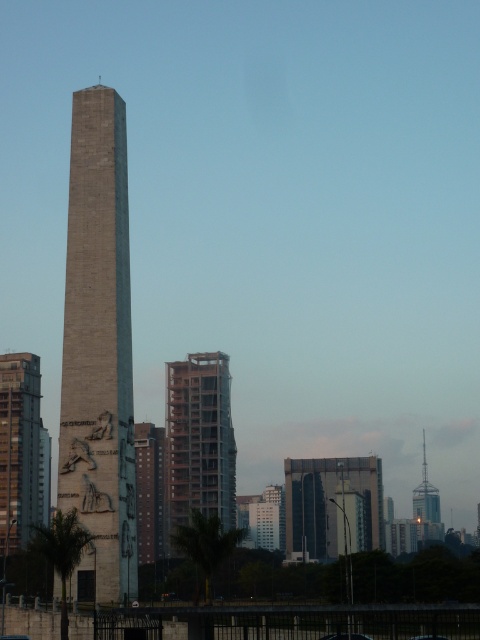
Question: From the image, what is the correct spatial relationship of gray stone obelisk at center in relation to dark glass building at center?

Choices:
 (A) above
 (B) below

Answer: (A)

Question: Which point appears farthest from the camera in this image?

Choices:
 (A) (343, 465)
 (B) (427, 483)
 (C) (11, 429)

Answer: (B)

Question: Can you confirm if gray stone obelisk at center is thinner than smooth concrete tower at left?

Choices:
 (A) yes
 (B) no

Answer: (A)

Question: Observing the image, what is the correct spatial positioning of smooth concrete building at center in reference to shiny metallic tower at right?

Choices:
 (A) left
 (B) right

Answer: (A)

Question: Which of the following is the farthest from the observer?

Choices:
 (A) (290, 513)
 (B) (25, 560)
 (C) (187, 362)
 (D) (109, 193)

Answer: (A)

Question: Among these points, which one is nearest to the camera?

Choices:
 (A) (429, 520)
 (B) (132, 472)
 (C) (204, 440)

Answer: (B)